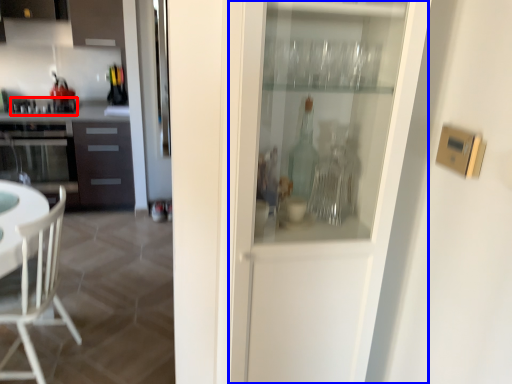
Question: Which of the following is the closest to the observer, appliance (highlighted by a red box) or screen door (highlighted by a blue box)?

Choices:
 (A) appliance
 (B) screen door

Answer: (B)